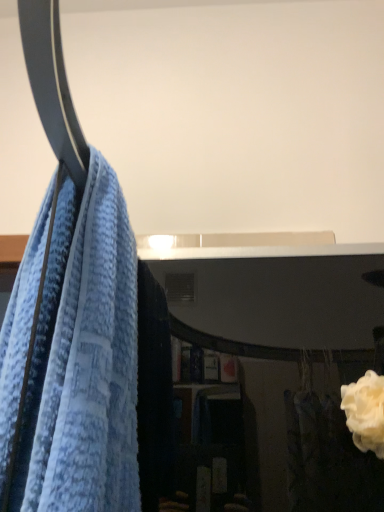
Question: Is blue textured towel at left wider or thinner than white matte rose at lower right?

Choices:
 (A) wide
 (B) thin

Answer: (A)

Question: Relative to white matte rose at lower right, is blue textured towel at left in front or behind?

Choices:
 (A) front
 (B) behind

Answer: (A)

Question: In the image, is blue textured towel at left on the left side or the right side of white matte rose at lower right?

Choices:
 (A) left
 (B) right

Answer: (A)

Question: Is white matte rose at lower right wider or thinner than blue textured towel at left?

Choices:
 (A) wide
 (B) thin

Answer: (B)

Question: From a real-world perspective, relative to blue textured towel at left, is white matte rose at lower right vertically above or below?

Choices:
 (A) above
 (B) below

Answer: (B)

Question: Is white matte rose at lower right bigger or smaller than blue textured towel at left?

Choices:
 (A) small
 (B) big

Answer: (A)

Question: In terms of height, does white matte rose at lower right look taller or shorter compared to blue textured towel at left?

Choices:
 (A) tall
 (B) short

Answer: (B)